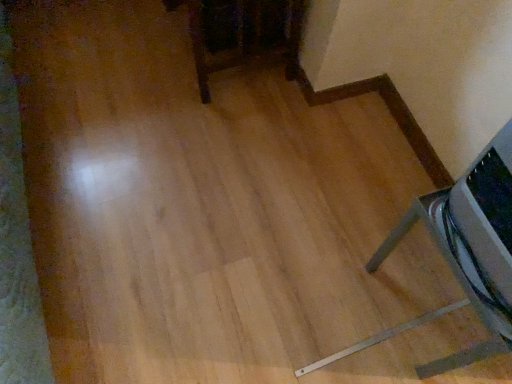
Locate an element on the screen. Image resolution: width=512 pixels, height=384 pixels. metallic silver speaker at lower right, positioned as the 2th furniture in top-to-bottom order is located at coordinates point(473,231).

Describe the element at coordinates (473, 231) in the screenshot. This screenshot has width=512, height=384. I see `metallic silver speaker at lower right, the 1th furniture positioned from the bottom` at that location.

How much space does dark wood table at upper center, marked as the first furniture in a left-to-right arrangement, occupy vertically?

The height of dark wood table at upper center, marked as the first furniture in a left-to-right arrangement, is 17.57 inches.

What do you see at coordinates (243, 35) in the screenshot? I see `dark wood table at upper center, marked as the first furniture in a left-to-right arrangement` at bounding box center [243, 35].

I want to click on dark wood table at upper center, which is the second furniture in bottom-to-top order, so click(243, 35).

Identify the location of metallic silver speaker at lower right, positioned as the 2th furniture in top-to-bottom order. (473, 231).

Between dark wood table at upper center, marked as the first furniture in a left-to-right arrangement, and metallic silver speaker at lower right, the 1th furniture positioned from the bottom, which one appears on the right side from the viewer's perspective?

metallic silver speaker at lower right, the 1th furniture positioned from the bottom.

Is dark wood table at upper center, arranged as the second furniture when viewed from the right, in front of or behind metallic silver speaker at lower right, placed as the second furniture when sorted from left to right, in the image?

Clearly, dark wood table at upper center, arranged as the second furniture when viewed from the right, is behind metallic silver speaker at lower right, placed as the second furniture when sorted from left to right.

Considering the points (198, 77) and (485, 307), which point is in front, point (198, 77) or point (485, 307)?

The point (485, 307) is closer.

From the image's perspective, which object appears higher, dark wood table at upper center, which is the second furniture in bottom-to-top order, or metallic silver speaker at lower right, placed as the second furniture when sorted from left to right?

dark wood table at upper center, which is the second furniture in bottom-to-top order, is shown above in the image.

From a real-world perspective, is dark wood table at upper center, arranged as the second furniture when viewed from the right, physically located above or below metallic silver speaker at lower right, positioned as the 2th furniture in top-to-bottom order?

dark wood table at upper center, arranged as the second furniture when viewed from the right, is situated lower than metallic silver speaker at lower right, positioned as the 2th furniture in top-to-bottom order, in the real world.

In terms of width, does dark wood table at upper center, marked as the first furniture in a left-to-right arrangement, look wider or thinner when compared to metallic silver speaker at lower right, placed as the second furniture when sorted from left to right?

In the image, dark wood table at upper center, marked as the first furniture in a left-to-right arrangement, appears to be wider than metallic silver speaker at lower right, placed as the second furniture when sorted from left to right.

Can you confirm if dark wood table at upper center, which is the second furniture in bottom-to-top order, is taller than metallic silver speaker at lower right, the 1th furniture positioned from the bottom?

Correct, dark wood table at upper center, which is the second furniture in bottom-to-top order, is much taller as metallic silver speaker at lower right, the 1th furniture positioned from the bottom.

Consider the image. Can you confirm if dark wood table at upper center, which is counted as the first furniture, starting from the top, is smaller than metallic silver speaker at lower right, the 1th furniture positioned from the bottom?

No.

Is dark wood table at upper center, arranged as the second furniture when viewed from the right, outside of metallic silver speaker at lower right, arranged as the first furniture when viewed from the right?

That's correct, dark wood table at upper center, arranged as the second furniture when viewed from the right, is outside of metallic silver speaker at lower right, arranged as the first furniture when viewed from the right.

Are dark wood table at upper center, marked as the first furniture in a left-to-right arrangement, and metallic silver speaker at lower right, the 1th furniture positioned from the bottom, located far from each other?

No, there isn't a large distance between dark wood table at upper center, marked as the first furniture in a left-to-right arrangement, and metallic silver speaker at lower right, the 1th furniture positioned from the bottom.

Does dark wood table at upper center, which is the second furniture in bottom-to-top order, turn towards metallic silver speaker at lower right, the 1th furniture positioned from the bottom?

No, dark wood table at upper center, which is the second furniture in bottom-to-top order, is not oriented towards metallic silver speaker at lower right, the 1th furniture positioned from the bottom.

Can you tell me how much dark wood table at upper center, arranged as the second furniture when viewed from the right, and metallic silver speaker at lower right, arranged as the first furniture when viewed from the right, differ in facing direction?

1.2 degrees.

This screenshot has height=384, width=512. I want to click on furniture located below the dark wood table at upper center, arranged as the second furniture when viewed from the right (from the image's perspective), so click(473, 231).

Considering the positions of objects metallic silver speaker at lower right, the 1th furniture positioned from the bottom, and dark wood table at upper center, which is counted as the first furniture, starting from the top, in the image provided, who is more to the left, metallic silver speaker at lower right, the 1th furniture positioned from the bottom, or dark wood table at upper center, which is counted as the first furniture, starting from the top,?

From the viewer's perspective, dark wood table at upper center, which is counted as the first furniture, starting from the top, appears more on the left side.

Considering their positions, is metallic silver speaker at lower right, positioned as the 2th furniture in top-to-bottom order, located in front of or behind dark wood table at upper center, which is the second furniture in bottom-to-top order?

metallic silver speaker at lower right, positioned as the 2th furniture in top-to-bottom order, is in front of dark wood table at upper center, which is the second furniture in bottom-to-top order.

Is point (483, 224) behind point (238, 20)?

No, it is not.

From the image's perspective, between metallic silver speaker at lower right, arranged as the first furniture when viewed from the right, and dark wood table at upper center, which is the second furniture in bottom-to-top order, who is located below?

metallic silver speaker at lower right, arranged as the first furniture when viewed from the right.

From a real-world perspective, does metallic silver speaker at lower right, placed as the second furniture when sorted from left to right, stand above dark wood table at upper center, which is the second furniture in bottom-to-top order?

Yes, from a real-world perspective, metallic silver speaker at lower right, placed as the second furniture when sorted from left to right, is on top of dark wood table at upper center, which is the second furniture in bottom-to-top order.

Considering the sizes of objects metallic silver speaker at lower right, arranged as the first furniture when viewed from the right, and dark wood table at upper center, marked as the first furniture in a left-to-right arrangement, in the image provided, who is thinner, metallic silver speaker at lower right, arranged as the first furniture when viewed from the right, or dark wood table at upper center, marked as the first furniture in a left-to-right arrangement,?

Thinner between the two is metallic silver speaker at lower right, arranged as the first furniture when viewed from the right.

Between metallic silver speaker at lower right, arranged as the first furniture when viewed from the right, and dark wood table at upper center, marked as the first furniture in a left-to-right arrangement, which one has less height?

metallic silver speaker at lower right, arranged as the first furniture when viewed from the right.

Between metallic silver speaker at lower right, arranged as the first furniture when viewed from the right, and dark wood table at upper center, arranged as the second furniture when viewed from the right, which one has smaller size?

metallic silver speaker at lower right, arranged as the first furniture when viewed from the right, is smaller.

Is dark wood table at upper center, which is the second furniture in bottom-to-top order, surrounded by metallic silver speaker at lower right, the 1th furniture positioned from the bottom?

No, dark wood table at upper center, which is the second furniture in bottom-to-top order, is not inside metallic silver speaker at lower right, the 1th furniture positioned from the bottom.

Is metallic silver speaker at lower right, the 1th furniture positioned from the bottom, far away from dark wood table at upper center, which is the second furniture in bottom-to-top order?

metallic silver speaker at lower right, the 1th furniture positioned from the bottom, is actually quite close to dark wood table at upper center, which is the second furniture in bottom-to-top order.

Is dark wood table at upper center, which is counted as the first furniture, starting from the top, at the back of metallic silver speaker at lower right, positioned as the 2th furniture in top-to-bottom order?

No.

Identify the location of furniture that is above the dark wood table at upper center, which is counted as the first furniture, starting from the top (from a real-world perspective). (473, 231).

At what (x,y) coordinates should I click in order to perform the action: click on furniture that is behind the metallic silver speaker at lower right, placed as the second furniture when sorted from left to right. Please return your answer as a coordinate pair (x, y). Image resolution: width=512 pixels, height=384 pixels. Looking at the image, I should click on (243, 35).

Where is `furniture in front of the dark wood table at upper center, which is counted as the first furniture, starting from the top`? furniture in front of the dark wood table at upper center, which is counted as the first furniture, starting from the top is located at coordinates (473, 231).